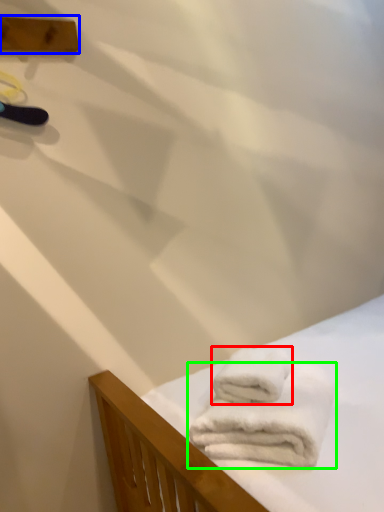
Question: Based on their relative distances, which object is nearer to towel (highlighted by a red box)? Choose from plank (highlighted by a blue box) and towel (highlighted by a green box).

Choices:
 (A) plank
 (B) towel

Answer: (B)